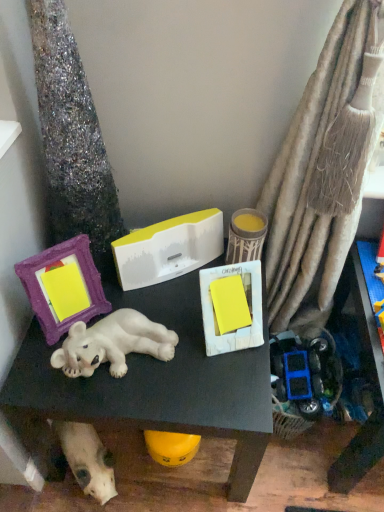
Where is `free point in front of purple fabric picture frame at left`? free point in front of purple fabric picture frame at left is located at coordinates (56, 382).